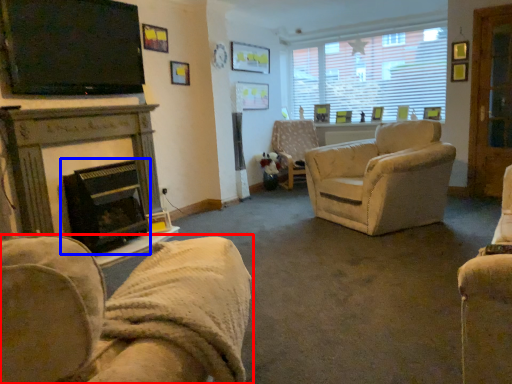
Question: Which point is closer to the camera, chair (highlighted by a red box) or fireplace (highlighted by a blue box)?

Choices:
 (A) chair
 (B) fireplace

Answer: (A)